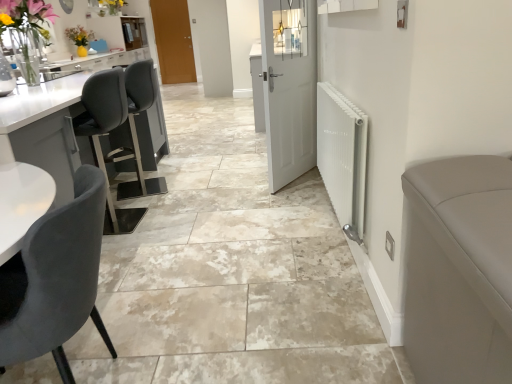
Question: Is point (46, 69) positioned closer to the camera than point (169, 28)?

Choices:
 (A) closer
 (B) farther

Answer: (A)

Question: Which is correct: white glossy sink at upper left is inside brown wooden door at upper center, arranged as the 1th door when viewed from the left, or outside of it?

Choices:
 (A) inside
 (B) outside

Answer: (B)

Question: Estimate the real-world distances between objects in this image. Which object is farther from the white metallic radiator at right?

Choices:
 (A) velvet grey chair at lower left
 (B) white glossy sink at upper left
 (C) white matte door at center, positioned as the second door in left-to-right order
 (D) brown wooden door at upper center, which is the 1th door from top to bottom

Answer: (D)

Question: Based on their relative distances, which object is farther from the white metallic radiator at right?

Choices:
 (A) white glossy sink at upper left
 (B) brown wooden door at upper center, marked as the first door in a back-to-front arrangement
 (C) velvet grey chair at lower left
 (D) white matte door at center, which is counted as the second door, starting from the top

Answer: (B)